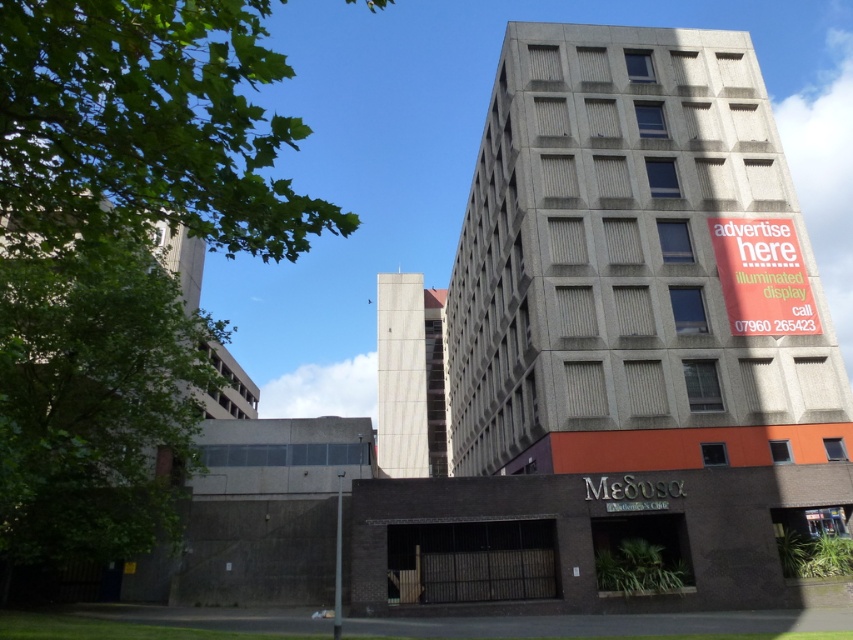
Between concrete building at upper right and green concrete building at left, which one is positioned lower?

concrete building at upper right is below.

From the picture: Who is more forward, (585,308) or (207,403)?

Point (585,308)

Find the location of a particular element. This screenshot has width=853, height=640. concrete building at upper right is located at coordinates (635, 266).

Is white concrete building at center closer to camera compared to green concrete building at left?

No, white concrete building at center is behind green concrete building at left.

Between white concrete building at center and green concrete building at left, which one is positioned higher?

Positioned higher is green concrete building at left.

Does point (439, 305) lie behind point (167, 230)?

Yes, it is behind point (167, 230).

Image resolution: width=853 pixels, height=640 pixels. What are the coordinates of `white concrete building at center` in the screenshot? It's located at (410, 378).

Which of these two, concrete building at upper right or white concrete building at center, stands taller?

concrete building at upper right

Which is more to the right, concrete building at upper right or white concrete building at center?

Positioned to the right is concrete building at upper right.

Is point (695, 330) behind point (428, 420)?

No, it is not.

Locate an element on the screen. The height and width of the screenshot is (640, 853). concrete building at upper right is located at coordinates (635, 266).